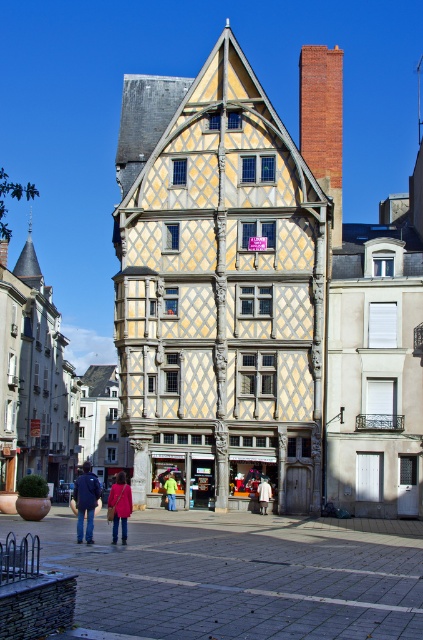
Consider the image. Can you confirm if blue denim jacket at lower left is positioned below green fabric jacket at center?

Correct, blue denim jacket at lower left is located below green fabric jacket at center.

Does blue denim jacket at lower left have a greater width compared to green fabric jacket at center?

Correct, the width of blue denim jacket at lower left exceeds that of green fabric jacket at center.

Does point (90, 490) lie behind point (170, 483)?

No, it is not.

You are a GUI agent. You are given a task and a screenshot of the screen. Output one action in this format:
    pyautogui.click(x=<x>, y=<y>)
    Task: Click on the blue denim jacket at lower left
    
    Given the screenshot: What is the action you would take?
    pyautogui.click(x=85, y=500)

Locate an element on the screen. pink fabric coat at lower center is located at coordinates (120, 506).

Where is `pink fabric coat at lower center`? Image resolution: width=423 pixels, height=640 pixels. pink fabric coat at lower center is located at coordinates (120, 506).

Where is `pink fabric coat at lower center`? The height and width of the screenshot is (640, 423). pink fabric coat at lower center is located at coordinates (120, 506).

Is white cotton shirt at center smaller than green fabric jacket at center?

Indeed, white cotton shirt at center has a smaller size compared to green fabric jacket at center.

Is white cotton shirt at center closer to the viewer compared to green fabric jacket at center?

Yes.

You are a GUI agent. You are given a task and a screenshot of the screen. Output one action in this format:
    pyautogui.click(x=<x>, y=<y>)
    Task: Click on the white cotton shirt at center
    The width and height of the screenshot is (423, 640).
    Given the screenshot: What is the action you would take?
    pyautogui.click(x=263, y=493)